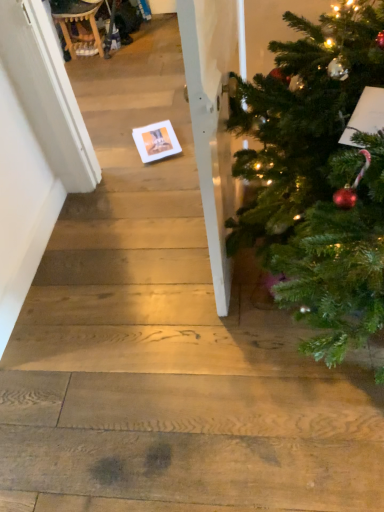
Question: Considering the relative positions of wooden rocking chair at upper left and white matte card at center in the image provided, is wooden rocking chair at upper left to the left of white matte card at center from the viewer's perspective?

Choices:
 (A) yes
 (B) no

Answer: (A)

Question: Is wooden rocking chair at upper left oriented away from white matte card at center?

Choices:
 (A) no
 (B) yes

Answer: (A)

Question: Considering the relative positions of wooden rocking chair at upper left and white matte card at center in the image provided, is wooden rocking chair at upper left to the right of white matte card at center from the viewer's perspective?

Choices:
 (A) yes
 (B) no

Answer: (B)

Question: Can you confirm if wooden rocking chair at upper left is wider than white matte card at center?

Choices:
 (A) no
 (B) yes

Answer: (A)

Question: Can you see wooden rocking chair at upper left touching white matte card at center?

Choices:
 (A) yes
 (B) no

Answer: (B)

Question: Can you confirm if wooden rocking chair at upper left is smaller than white matte card at center?

Choices:
 (A) no
 (B) yes

Answer: (A)

Question: From a real-world perspective, is white matte card at center on top of wooden rocking chair at upper left?

Choices:
 (A) yes
 (B) no

Answer: (B)

Question: From a real-world perspective, is white matte card at center below wooden rocking chair at upper left?

Choices:
 (A) yes
 (B) no

Answer: (A)

Question: From the image's perspective, is white matte card at center over wooden rocking chair at upper left?

Choices:
 (A) yes
 (B) no

Answer: (B)

Question: Does white matte card at center turn towards wooden rocking chair at upper left?

Choices:
 (A) no
 (B) yes

Answer: (A)

Question: Is white matte card at center to the right of wooden rocking chair at upper left from the viewer's perspective?

Choices:
 (A) yes
 (B) no

Answer: (A)

Question: Is the depth of white matte card at center less than that of wooden rocking chair at upper left?

Choices:
 (A) yes
 (B) no

Answer: (A)

Question: From their relative heights in the image, would you say wooden rocking chair at upper left is taller or shorter than white matte card at center?

Choices:
 (A) short
 (B) tall

Answer: (B)